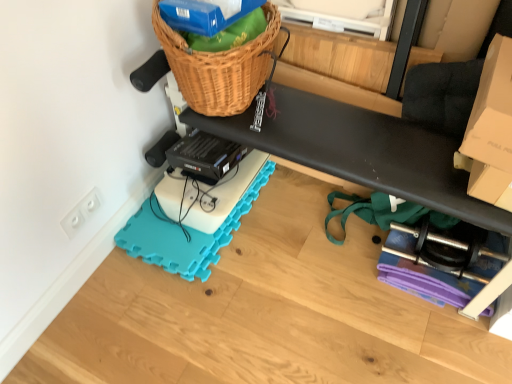
Where is `vacant point above woven brown basket at upper center (from a real-world perspective)`? Image resolution: width=512 pixels, height=384 pixels. vacant point above woven brown basket at upper center (from a real-world perspective) is located at coordinates (237, 24).